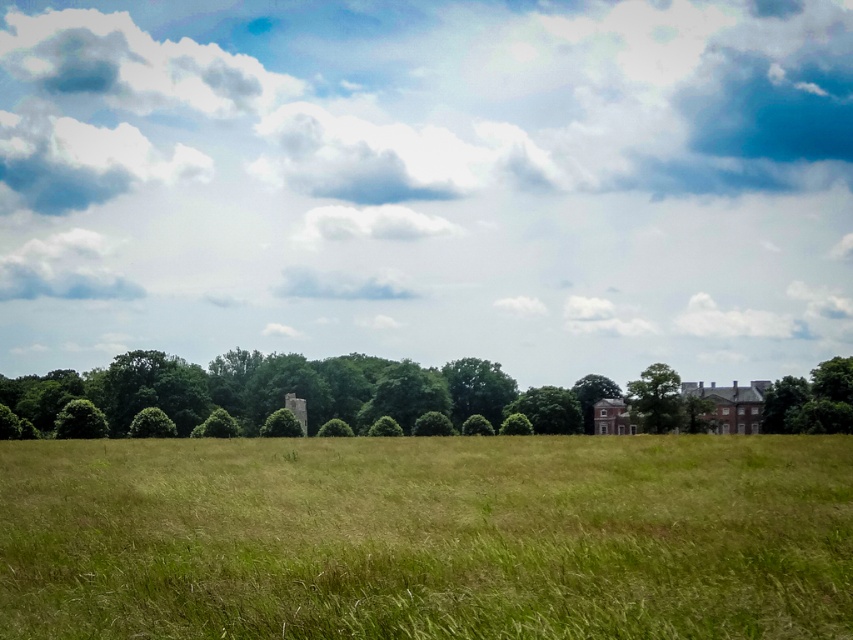
In the scene shown: You are standing at the point with coordinates point (509,378) and want to walk to point (772,392). Given that the terrain between these two points is uneven and overgrown, will you have to walk uphill or downhill?

Since point (509,378) is further to the viewer than point (772,392), you will have to walk uphill towards the latter point.